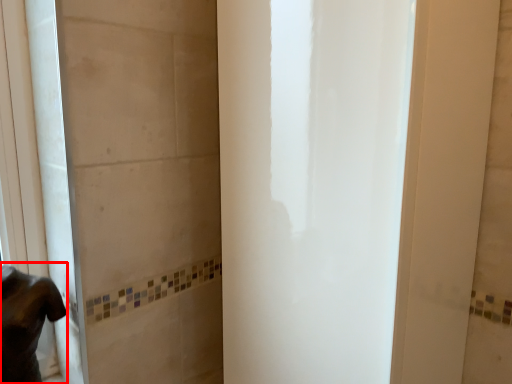
Question: From the image's perspective, what is the correct spatial relationship of person (annotated by the red box) in relation to screen door?

Choices:
 (A) above
 (B) below

Answer: (B)